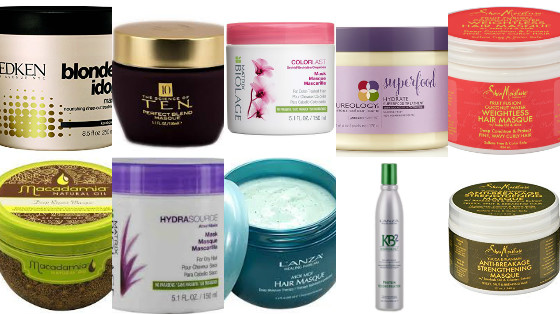
Find the location of `tub`. tub is located at coordinates (56, 80), (149, 84), (292, 80), (382, 96), (521, 100), (65, 266), (172, 258), (282, 258), (526, 270).